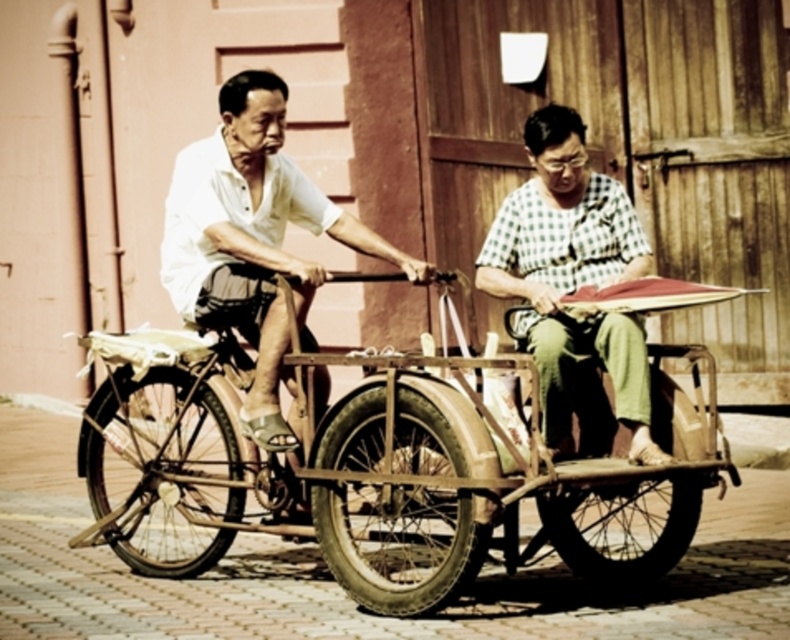
Does white cotton shirt at center have a lesser height compared to metallic brown bicycle at center?

Indeed, white cotton shirt at center has a lesser height compared to metallic brown bicycle at center.

Describe the element at coordinates (254, 241) in the screenshot. I see `white cotton shirt at center` at that location.

Is point (243, 88) in front of point (96, 392)?

Yes.

At what (x,y) coordinates should I click in order to perform the action: click on white cotton shirt at center. Please return your answer as a coordinate pair (x, y). Looking at the image, I should click on (254, 241).

The image size is (790, 640). Find the location of `metallic brown bicycle at center`. metallic brown bicycle at center is located at coordinates (172, 461).

Which is in front, point (151, 493) or point (570, 132)?

Point (570, 132) is more forward.

Is point (211, 529) in front of point (514, 282)?

No, it is not.

You are a GUI agent. You are given a task and a screenshot of the screen. Output one action in this format:
    pyautogui.click(x=<x>, y=<y>)
    Task: Click on the metallic brown bicycle at center
    Image resolution: width=790 pixels, height=640 pixels.
    Given the screenshot: What is the action you would take?
    pyautogui.click(x=172, y=461)

You are a GUI agent. You are given a task and a screenshot of the screen. Output one action in this format:
    pyautogui.click(x=<x>, y=<y>)
    Task: Click on the white cotton shirt at center
    This screenshot has height=640, width=790.
    Given the screenshot: What is the action you would take?
    pyautogui.click(x=254, y=241)

Between point (280, 300) and point (570, 320), which one is positioned behind?

Positioned behind is point (280, 300).

Find the location of a particular element. The image size is (790, 640). white cotton shirt at center is located at coordinates (254, 241).

Image resolution: width=790 pixels, height=640 pixels. In order to click on white cotton shirt at center in this screenshot , I will do `click(254, 241)`.